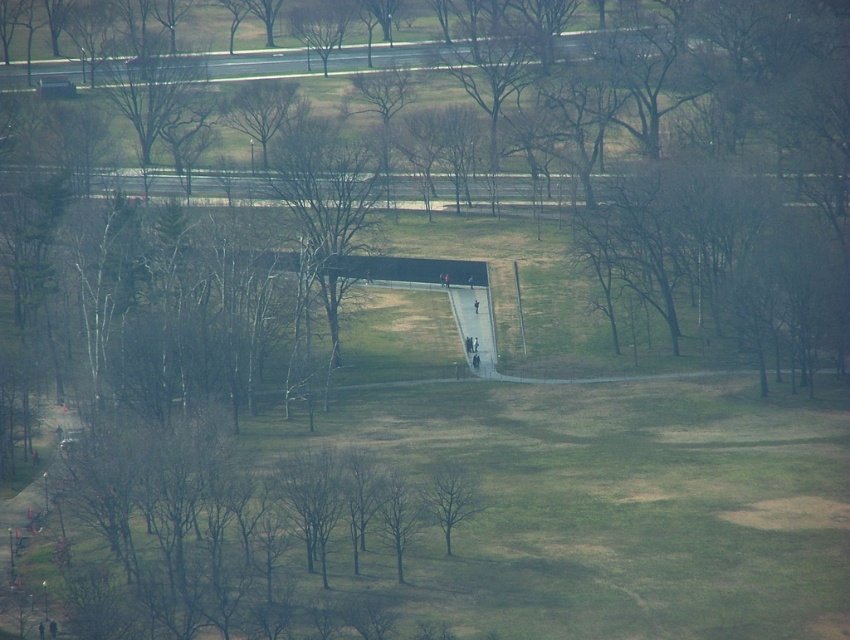
Is bare branches at center below green leafy tree at center?

Incorrect, bare branches at center is not positioned below green leafy tree at center.

Who is more forward, (264, 163) or (479, 490)?

Positioned in front is point (479, 490).

The width and height of the screenshot is (850, 640). In order to click on bare branches at center in this screenshot , I will do `click(262, 109)`.

The width and height of the screenshot is (850, 640). What are the coordinates of `bare branches at center` in the screenshot? It's located at (262, 109).